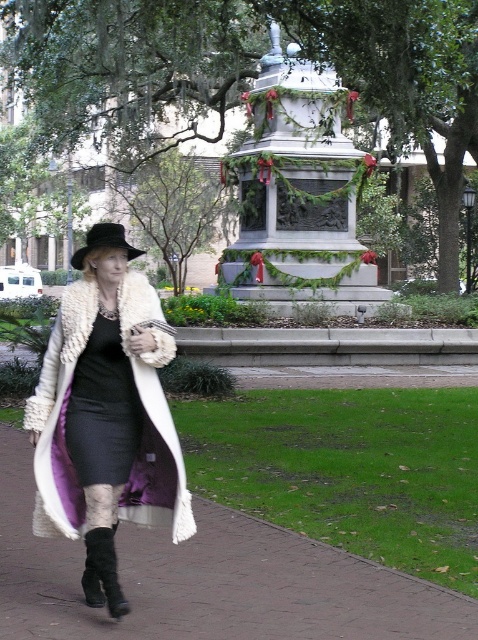
Can you confirm if smooth concrete pavement at lower center is smaller than black felt fedora at center?

Yes.

The image size is (478, 640). Identify the location of smooth concrete pavement at lower center. (209, 580).

Is white fur coat at left further to the viewer compared to black felt fedora at center?

No.

Looking at this image, does white fur coat at left have a smaller size compared to black felt fedora at center?

Yes, white fur coat at left is smaller than black felt fedora at center.

Where is `white fur coat at left`? This screenshot has width=478, height=640. white fur coat at left is located at coordinates (106, 413).

Locate an element on the screen. This screenshot has width=478, height=640. white fur coat at left is located at coordinates (106, 413).

Image resolution: width=478 pixels, height=640 pixels. What do you see at coordinates (209, 580) in the screenshot?
I see `smooth concrete pavement at lower center` at bounding box center [209, 580].

Is smooth concrete pavement at lower center positioned behind black satin dress at center?

No, smooth concrete pavement at lower center is in front of black satin dress at center.

This screenshot has width=478, height=640. Describe the element at coordinates (209, 580) in the screenshot. I see `smooth concrete pavement at lower center` at that location.

This screenshot has height=640, width=478. In order to click on smooth concrete pavement at lower center in this screenshot , I will do `click(209, 580)`.